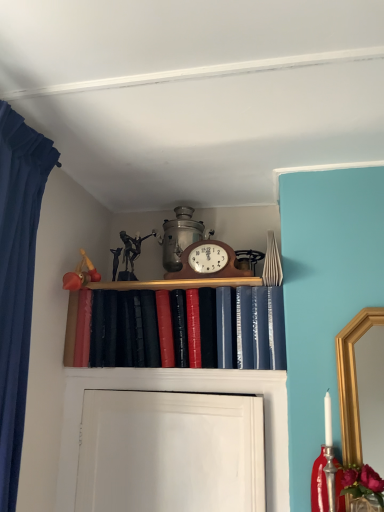
Question: In terms of width, does wooden clock at center look wider or thinner when compared to shiny leather book at center?

Choices:
 (A) wide
 (B) thin

Answer: (B)

Question: Is wooden clock at center to the left or to the right of shiny leather book at center in the image?

Choices:
 (A) left
 (B) right

Answer: (B)

Question: From a real-world perspective, is wooden clock at center physically located above or below shiny leather book at center?

Choices:
 (A) below
 (B) above

Answer: (B)

Question: Is shiny leather book at center in front of or behind wooden clock at center in the image?

Choices:
 (A) behind
 (B) front

Answer: (B)

Question: Does point (148, 359) appear closer or farther from the camera than point (215, 246)?

Choices:
 (A) closer
 (B) farther

Answer: (A)

Question: Choose the correct answer: Is shiny leather book at center inside wooden clock at center or outside it?

Choices:
 (A) outside
 (B) inside

Answer: (A)

Question: From the image's perspective, is shiny leather book at center located above or below wooden clock at center?

Choices:
 (A) above
 (B) below

Answer: (B)